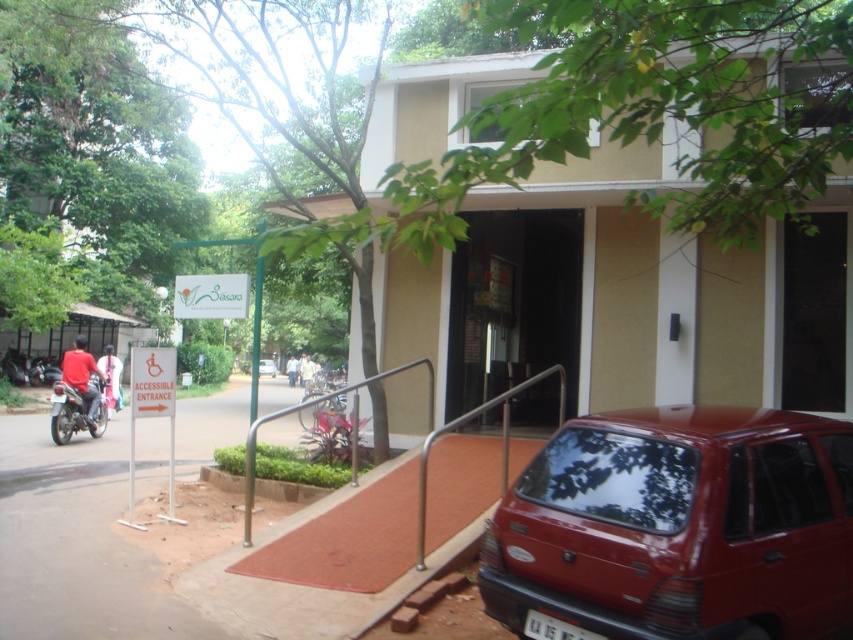
Question: Is silver metallic handrail at center to the left of shiny black motorcycle at left from the viewer's perspective?

Choices:
 (A) yes
 (B) no

Answer: (B)

Question: Where is red matte motorcycle at left located in relation to matte red car at center in the image?

Choices:
 (A) right
 (B) left

Answer: (A)

Question: Which point appears closest to the camera in this image?

Choices:
 (A) (570, 454)
 (B) (84, 385)
 (C) (543, 634)
 (D) (502, 483)

Answer: (C)

Question: Which of the following is the farthest from the observer?

Choices:
 (A) shiny black motorcycle at left
 (B) matte red car at center

Answer: (B)

Question: Which point is closer to the camera?

Choices:
 (A) silver metallic handrail at center
 (B) matte red car at center
 (C) matte red car at lower right
 (D) red matte motorcycle at left

Answer: (C)

Question: Does silver metallic handrail at center come behind shiny black motorcycle at left?

Choices:
 (A) yes
 (B) no

Answer: (B)